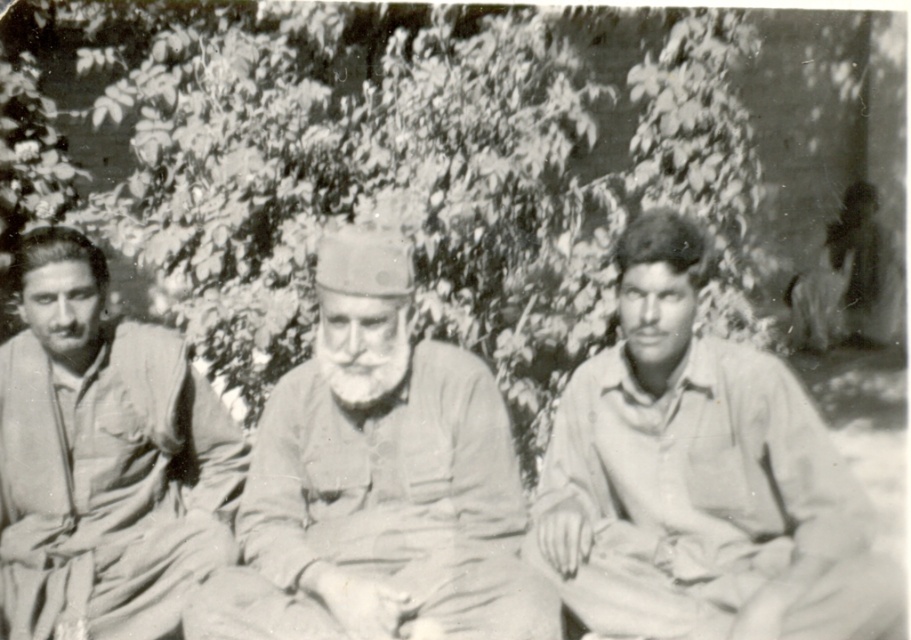
You are standing in front of the photograph and want to locate the light gray shirt at center. Where exactly should you look?

You should look at point (700, 480) to locate the light gray shirt at center.

Looking at this image, based on the scene described, which object is positioned closer to the viewer between the light gray shirt at center and the matte khaki uniform at center?

The light gray shirt at center is positioned closer to the viewer because it is in front of the matte khaki uniform at center.

In the scene described, there are two individuals wearing the light gray shirt at center and the matte khaki uniform at center. Which of these two items of clothing appears larger in the image?

The light gray shirt at center appears larger than the matte khaki uniform at center in the image.